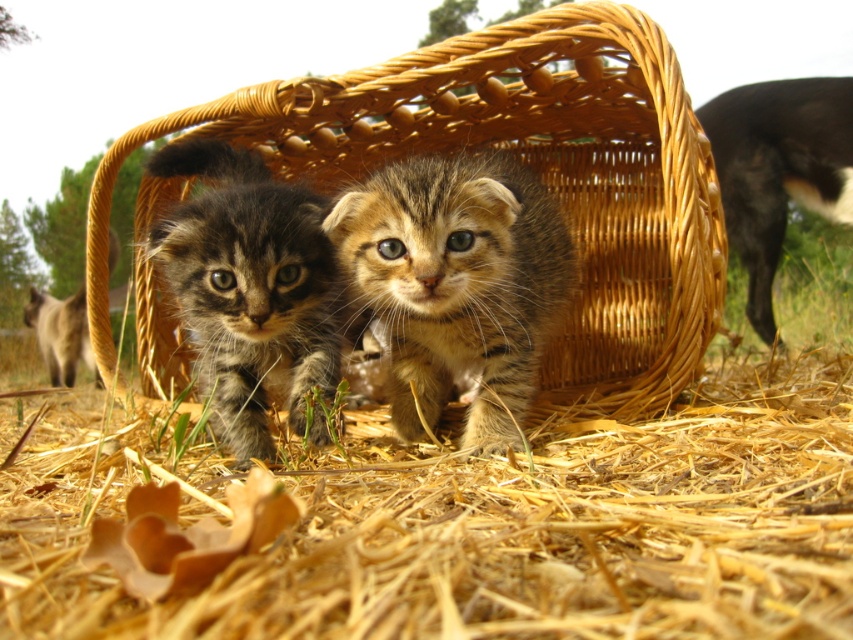
Consider the image. You are a photographer setting up a shot of the dry straw at lower center and the black fur dog at upper right. To ensure both subjects are in focus, you need to know their vertical positions. Which one is higher up in the image?

The black fur dog at upper right is higher up in the image than the dry straw at lower center.